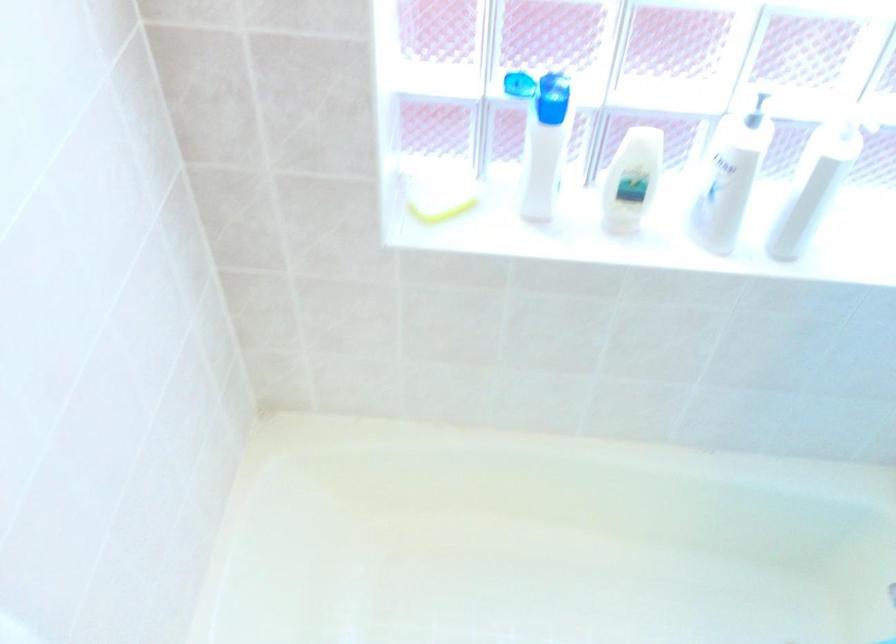
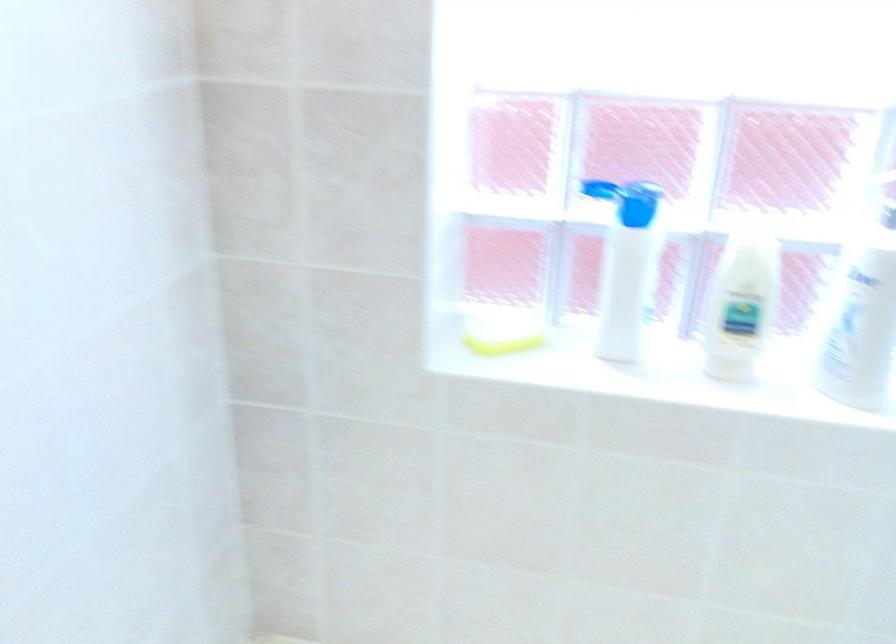
Find the pixel in the second image that matches [552,105] in the first image.

(636, 203)